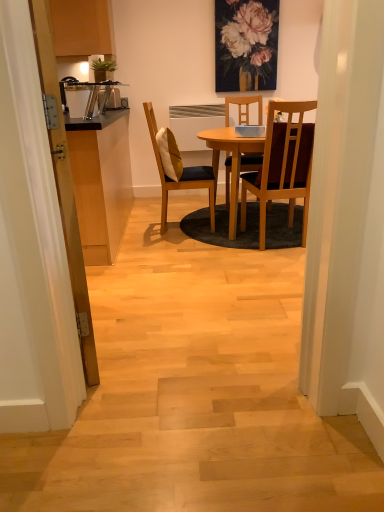
This screenshot has width=384, height=512. What do you see at coordinates (249, 32) in the screenshot?
I see `matte floral painting at upper center` at bounding box center [249, 32].

In order to face matte yellow cushioned chair at center, which is the 1th chair from left to right, should I rotate leftwards or rightwards?

To align with it, rotate left about 1.212°.

This screenshot has height=512, width=384. I want to click on wooden cabinet at left, so click(101, 182).

Where is `wooden chair at center, positioned as the first chair in right-to-left order`? Image resolution: width=384 pixels, height=512 pixels. wooden chair at center, positioned as the first chair in right-to-left order is located at coordinates (282, 165).

Between matte floral painting at upper center and matte yellow cushioned chair at center, which is the 1th chair from left to right, which one has more height?

With more height is matte yellow cushioned chair at center, which is the 1th chair from left to right.

From the image's perspective, who appears lower, matte floral painting at upper center or matte yellow cushioned chair at center, which is the second chair in right-to-left order?

matte yellow cushioned chair at center, which is the second chair in right-to-left order, appears lower in the image.

Are matte floral painting at upper center and matte yellow cushioned chair at center, which is the 1th chair from left to right, beside each other?

They are not placed beside each other.

Is matte floral painting at upper center turned away from matte yellow cushioned chair at center, which is the 1th chair from left to right?

No, matte floral painting at upper center is not facing away from matte yellow cushioned chair at center, which is the 1th chair from left to right.

Looking at this image, is wooden cabinet at left touching wooden door at left?

wooden cabinet at left and wooden door at left are clearly separated.

Is point (124, 214) less distant than point (89, 331)?

No, (124, 214) is further to viewer.

From the image's perspective, which is below, wooden cabinet at left or wooden door at left?

wooden door at left.

Is wooden cabinet at left facing away from wooden door at left?

wooden cabinet at left is not turned away from wooden door at left.

Is wooden cabinet at left facing away from soft yellow cushion at center?

Yes, soft yellow cushion at center is at the back of wooden cabinet at left.

Based on the photo, is soft yellow cushion at center surrounded by wooden cabinet at left?

No, soft yellow cushion at center is not a part of wooden cabinet at left.

Between wooden cabinet at left and soft yellow cushion at center, which one has less height?

soft yellow cushion at center is shorter.

Is point (99, 125) closer or farther from the camera than point (244, 30)?

Clearly, point (99, 125) is closer to the camera than point (244, 30).

You are a GUI agent. You are given a task and a screenshot of the screen. Output one action in this format:
    pyautogui.click(x=<x>, y=<y>)
    Task: Click on the cabinetry on the left of matte floral painting at upper center
    The image size is (384, 512).
    Given the screenshot: What is the action you would take?
    pyautogui.click(x=101, y=182)

Based on the photo, from the image's perspective, is wooden cabinet at left under matte floral painting at upper center?

Yes, from the image's perspective, wooden cabinet at left is below matte floral painting at upper center.

Considering their positions, is wooden cabinet at left located in front of or behind matte floral painting at upper center?

Visually, wooden cabinet at left is located in front of matte floral painting at upper center.

Does wooden cabinet at left touch wooden chair at center, positioned as the first chair in right-to-left order?

No, wooden cabinet at left is not making contact with wooden chair at center, positioned as the first chair in right-to-left order.

Can you confirm if wooden cabinet at left is shorter than wooden chair at center, marked as the 2th chair in a left-to-right arrangement?

Correct, wooden cabinet at left is not as tall as wooden chair at center, marked as the 2th chair in a left-to-right arrangement.

From a real-world perspective, between wooden cabinet at left and wooden chair at center, marked as the 2th chair in a left-to-right arrangement, who is vertically higher?

wooden chair at center, marked as the 2th chair in a left-to-right arrangement, from a real-world perspective.

From the picture: Which of these two, wooden cabinet at left or wooden chair at center, marked as the 2th chair in a left-to-right arrangement, is thinner?

Thinner between the two is wooden chair at center, marked as the 2th chair in a left-to-right arrangement.

Consider the image. Can you confirm if matte yellow cushioned chair at center, which is the 1th chair from left to right, is taller than wooden chair at center, positioned as the first chair in right-to-left order?

Yes, matte yellow cushioned chair at center, which is the 1th chair from left to right, is taller than wooden chair at center, positioned as the first chair in right-to-left order.

Considering the relative sizes of matte yellow cushioned chair at center, which is the 1th chair from left to right, and wooden chair at center, positioned as the first chair in right-to-left order, in the image provided, is matte yellow cushioned chair at center, which is the 1th chair from left to right, bigger than wooden chair at center, positioned as the first chair in right-to-left order,?

Yes, matte yellow cushioned chair at center, which is the 1th chair from left to right, is bigger than wooden chair at center, positioned as the first chair in right-to-left order.

Do you think matte yellow cushioned chair at center, which is the second chair in right-to-left order, is within wooden chair at center, marked as the 2th chair in a left-to-right arrangement, or outside of it?

matte yellow cushioned chair at center, which is the second chair in right-to-left order, is not enclosed by wooden chair at center, marked as the 2th chair in a left-to-right arrangement.

Looking at this image, from a real-world perspective, is matte yellow cushioned chair at center, which is the 1th chair from left to right, physically below wooden chair at center, marked as the 2th chair in a left-to-right arrangement?

Indeed, from a real-world perspective, matte yellow cushioned chair at center, which is the 1th chair from left to right, is positioned beneath wooden chair at center, marked as the 2th chair in a left-to-right arrangement.

Is matte yellow cushioned chair at center, which is the second chair in right-to-left order, aimed at wooden cabinet at left?

No, matte yellow cushioned chair at center, which is the second chair in right-to-left order, is not oriented towards wooden cabinet at left.

Is the depth of matte yellow cushioned chair at center, which is the 1th chair from left to right, greater than that of wooden cabinet at left?

Yes, it is behind wooden cabinet at left.

In the scene shown: Would you say matte yellow cushioned chair at center, which is the second chair in right-to-left order, is outside wooden cabinet at left?

Yes, matte yellow cushioned chair at center, which is the second chair in right-to-left order, is not within wooden cabinet at left.

What's the angular difference between matte yellow cushioned chair at center, which is the second chair in right-to-left order, and wooden cabinet at left's facing directions?

There is a 173-degree angle between the facing directions of matte yellow cushioned chair at center, which is the second chair in right-to-left order, and wooden cabinet at left.

Identify the location of flower on the right of matte yellow cushioned chair at center, which is the second chair in right-to-left order. (249, 32).

I want to click on door in front of the wooden cabinet at left, so click(65, 189).

Looking at the image, which one is located closer to wooden chair at center, marked as the 2th chair in a left-to-right arrangement, matte floral painting at upper center or matte yellow cushioned chair at center, which is the second chair in right-to-left order?

matte yellow cushioned chair at center, which is the second chair in right-to-left order, lies closer to wooden chair at center, marked as the 2th chair in a left-to-right arrangement, than the other object.

When comparing their distances from matte yellow cushioned chair at center, which is the 1th chair from left to right, does soft yellow cushion at center or wooden door at left seem further?

wooden door at left is further to matte yellow cushioned chair at center, which is the 1th chair from left to right.

Based on their spatial positions, is matte yellow cushioned chair at center, which is the second chair in right-to-left order, or soft yellow cushion at center closer to matte floral painting at upper center?

matte yellow cushioned chair at center, which is the second chair in right-to-left order, is closer to matte floral painting at upper center.

Estimate the real-world distances between objects in this image. Which object is closer to wooden cabinet at left, soft yellow cushion at center or matte yellow cushioned chair at center, which is the 1th chair from left to right?

soft yellow cushion at center.

Looking at the image, which one is located further to matte floral painting at upper center, wooden cabinet at left or wooden door at left?

The object further to matte floral painting at upper center is wooden cabinet at left.

Which object lies nearer to the anchor point wooden door at left, matte floral painting at upper center or matte yellow cushioned chair at center, which is the 1th chair from left to right?

Based on the image, matte yellow cushioned chair at center, which is the 1th chair from left to right, appears to be nearer to wooden door at left.

Looking at the image, which one is located further to wooden cabinet at left, matte yellow cushioned chair at center, which is the second chair in right-to-left order, or soft yellow cushion at center?

matte yellow cushioned chair at center, which is the second chair in right-to-left order, is further to wooden cabinet at left.

Looking at the image, which one is located closer to matte yellow cushioned chair at center, which is the 1th chair from left to right, wooden cabinet at left or matte floral painting at upper center?

Based on the image, wooden cabinet at left appears to be nearer to matte yellow cushioned chair at center, which is the 1th chair from left to right.

The width and height of the screenshot is (384, 512). I want to click on chair between matte floral painting at upper center and wooden chair at center, marked as the 2th chair in a left-to-right arrangement, in the up-down direction, so click(181, 175).

The image size is (384, 512). Identify the location of cabinetry between wooden door at left and matte floral painting at upper center along the z-axis. (101, 182).

Find the location of a particular element. This screenshot has height=512, width=384. cabinetry between wooden door at left and matte yellow cushioned chair at center, which is the 1th chair from left to right, in the front-back direction is located at coordinates (101, 182).

This screenshot has height=512, width=384. In order to click on pillow between wooden cabinet at left and matte floral painting at upper center along the z-axis in this screenshot , I will do `click(169, 154)`.